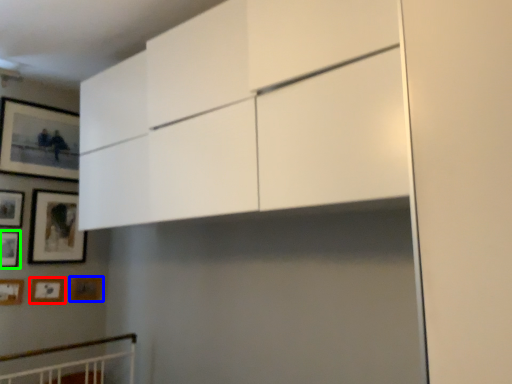
Question: Which is farther away from picture frame (highlighted by a red box)? picture frame (highlighted by a blue box) or picture frame (highlighted by a green box)?

Choices:
 (A) picture frame
 (B) picture frame

Answer: (B)